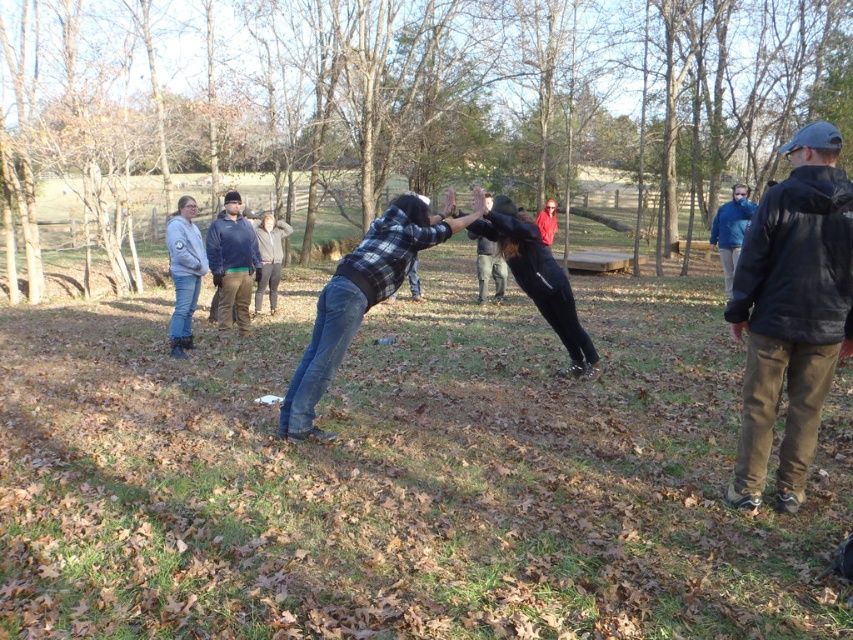
Can you confirm if flannel shirt at center is shorter than black flannel shirt at center?

No.

Does flannel shirt at center have a smaller size compared to black flannel shirt at center?

Correct, flannel shirt at center occupies less space than black flannel shirt at center.

Who is more distant from viewer, (296,404) or (491,275)?

Point (491,275)

Where is `flannel shirt at center`? This screenshot has height=640, width=853. flannel shirt at center is located at coordinates (358, 300).

The width and height of the screenshot is (853, 640). I want to click on dark blue fleece jacket at center, so click(231, 264).

Which of these two, dark blue fleece jacket at center or blue fleece jacket at upper right, stands shorter?

With less height is blue fleece jacket at upper right.

Find the location of a particular element. dark blue fleece jacket at center is located at coordinates (231, 264).

Where is `dark blue fleece jacket at center`? dark blue fleece jacket at center is located at coordinates (231, 264).

Can you confirm if black matte pants at center is bigger than blue fleece jacket at upper right?

Correct, black matte pants at center is larger in size than blue fleece jacket at upper right.

Does black matte pants at center appear over blue fleece jacket at upper right?

No.

You are a GUI agent. You are given a task and a screenshot of the screen. Output one action in this format:
    pyautogui.click(x=<x>, y=<y>)
    Task: Click on the black matte pants at center
    The height and width of the screenshot is (640, 853).
    Given the screenshot: What is the action you would take?
    pyautogui.click(x=537, y=276)